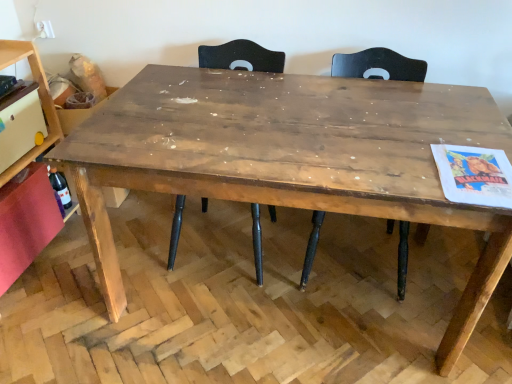
Question: From a real-world perspective, is rustic wood table at center positioned above or below translucent glass bottle at lower left?

Choices:
 (A) below
 (B) above

Answer: (B)

Question: Is rustic wood table at center in front of or behind translucent glass bottle at lower left in the image?

Choices:
 (A) front
 (B) behind

Answer: (A)

Question: Considering the real-world distances, which object is closest to the matte white cabinet at left, the second shelf positioned from the bottom?

Choices:
 (A) dark brown wood chair at center, which is the 1th chair from left to right
 (B) translucent glass bottle at lower left
 (C) wooden shelf at left, the 1th shelf in the bottom-to-top sequence
 (D) matte black chair at upper center, placed as the 1th chair when sorted from right to left
 (E) rustic wood table at center

Answer: (C)

Question: Which object is positioned farthest from the dark brown wood chair at center, which is the 2th chair in right-to-left order?

Choices:
 (A) wooden shelf at left, acting as the second shelf starting from the top
 (B) translucent glass bottle at lower left
 (C) rustic wood table at center
 (D) matte black chair at upper center, the second chair when ordered from left to right
 (E) matte white cabinet at left, marked as the first shelf in a top-to-bottom arrangement

Answer: (B)